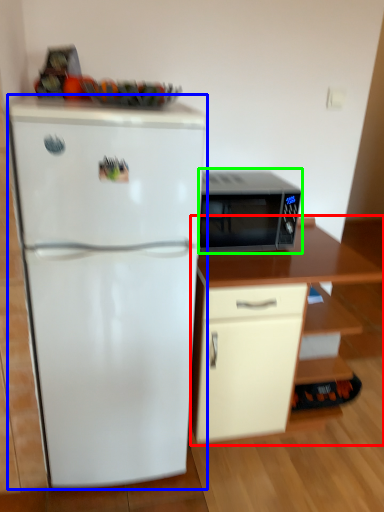
Question: Estimate the real-world distances between objects in this image. Which object is farther from cabinetry (highlighted by a red box), refrigerator (highlighted by a blue box) or microwave oven (highlighted by a green box)?

Choices:
 (A) refrigerator
 (B) microwave oven

Answer: (A)